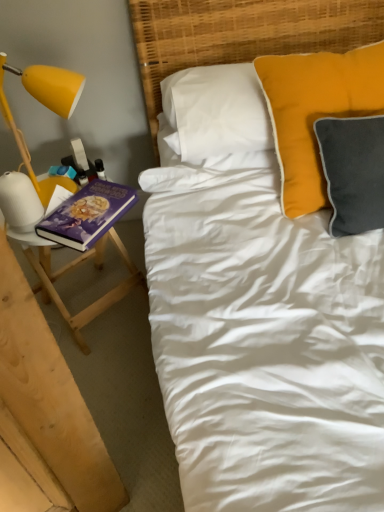
Question: In terms of size, does woven bamboo headboard at upper center appear bigger or smaller than yellow matte lamp at left?

Choices:
 (A) small
 (B) big

Answer: (B)

Question: Considering the positions of woven bamboo headboard at upper center and yellow matte lamp at left in the image, is woven bamboo headboard at upper center taller or shorter than yellow matte lamp at left?

Choices:
 (A) short
 (B) tall

Answer: (B)

Question: Estimate the real-world distances between objects in this image. Which object is closer to the woven bamboo headboard at upper center?

Choices:
 (A) yellow matte lamp at left
 (B) wooden stool at left
 (C) purple matte book at left
 (D) velvet orange pillow at upper right

Answer: (D)

Question: Which object is positioned farthest from the velvet orange pillow at upper right?

Choices:
 (A) wooden stool at left
 (B) purple matte book at left
 (C) woven bamboo headboard at upper center
 (D) yellow matte lamp at left

Answer: (A)